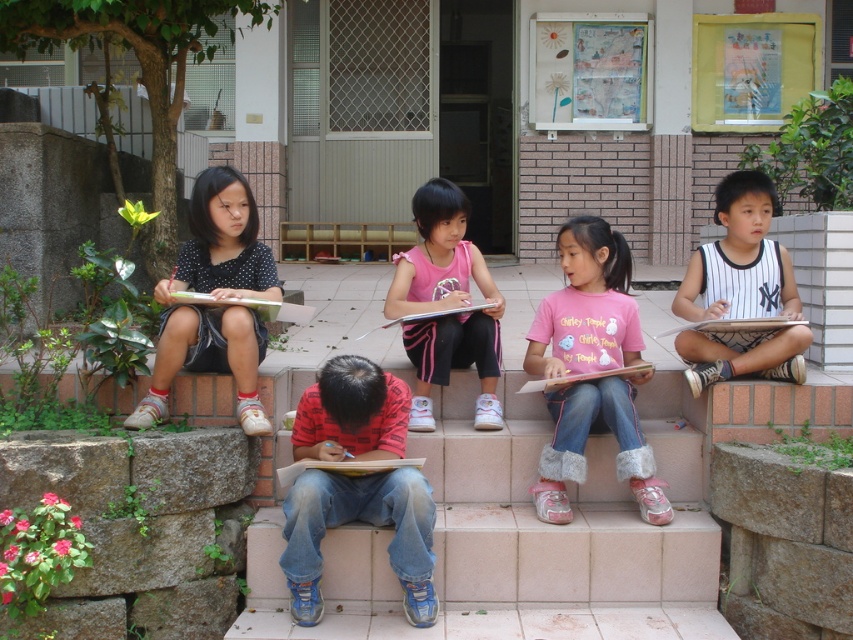
Does point (439, 403) lie behind point (392, 433)?

That is True.

Is pink fabric at center taller than red printed shirt at center?

No.

Which is in front, point (352, 605) or point (310, 602)?

Positioned in front is point (310, 602).

Where is `pink fabric at center`? This screenshot has height=640, width=853. pink fabric at center is located at coordinates (518, 540).

Who is higher up, polka dot fabric dress at left or matte pink book at center?

polka dot fabric dress at left is above.

Who is positioned more to the right, polka dot fabric dress at left or matte pink book at center?

Positioned to the right is matte pink book at center.

Between point (161, 394) and point (544, 388), which one is positioned in front?

Positioned in front is point (161, 394).

This screenshot has height=640, width=853. In order to click on polka dot fabric dress at left in this screenshot , I will do `click(213, 298)`.

Does polka dot fabric dress at left have a larger size compared to pink fabric shirt at center?

No, polka dot fabric dress at left is not bigger than pink fabric shirt at center.

Does polka dot fabric dress at left lie behind pink fabric shirt at center?

That is False.

Locate an element on the screen. This screenshot has width=853, height=640. polka dot fabric dress at left is located at coordinates (213, 298).

The width and height of the screenshot is (853, 640). Find the location of `polka dot fabric dress at left`. polka dot fabric dress at left is located at coordinates click(213, 298).